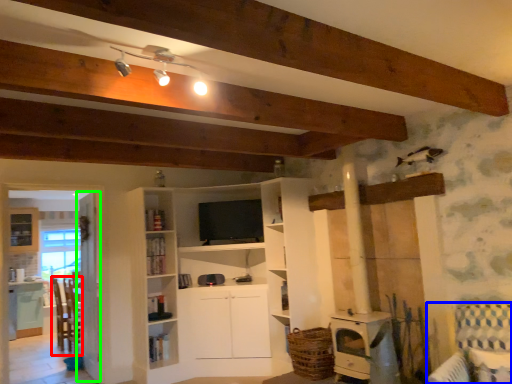
Question: Which object is the farthest from chair (highlighted by a red box)? Choose among these: armchair (highlighted by a blue box) or glass door (highlighted by a green box).

Choices:
 (A) armchair
 (B) glass door

Answer: (A)